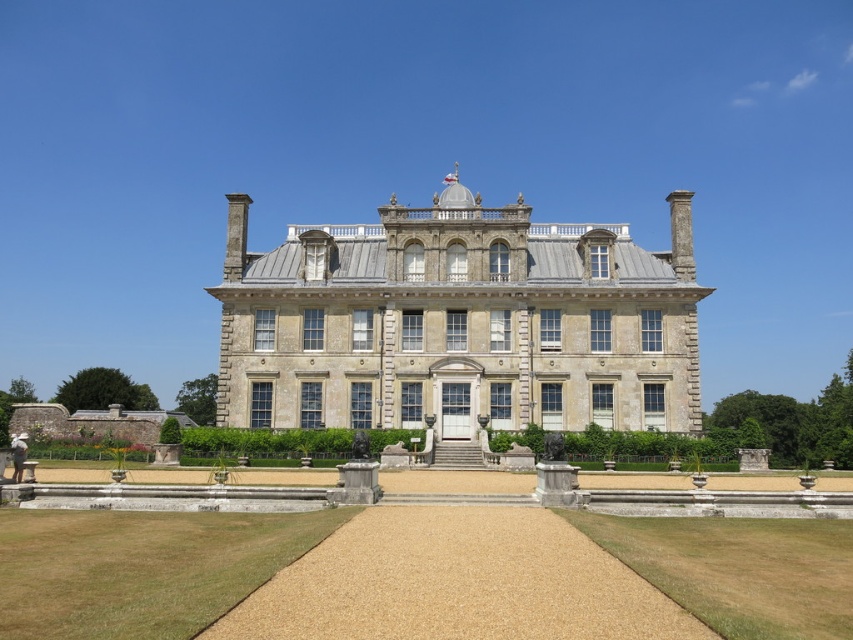
Question: Which point appears closest to the camera in this image?

Choices:
 (A) (634, 356)
 (B) (763, 557)

Answer: (B)

Question: Is green grass at lower center closer to camera compared to green grass at lower right?

Choices:
 (A) yes
 (B) no

Answer: (A)

Question: Among these objects, which one is farthest from the camera?

Choices:
 (A) green grass at lower center
 (B) green grass at lower right

Answer: (B)

Question: Can you confirm if stone mansion at center is bigger than green grass at lower right?

Choices:
 (A) no
 (B) yes

Answer: (B)

Question: Which point appears closest to the camera in this image?

Choices:
 (A) (700, 611)
 (B) (80, 518)
 (C) (469, 292)

Answer: (A)

Question: Can you confirm if green grass at lower center is positioned to the left of green grass at lower right?

Choices:
 (A) no
 (B) yes

Answer: (B)